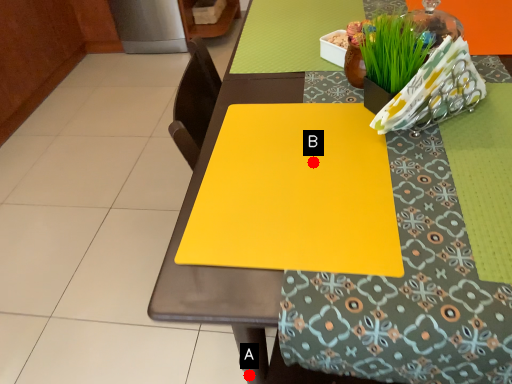
Question: Two points are circled on the image, labeled by A and B beside each circle. Which of the following is the closest to the observer?

Choices:
 (A) A is closer
 (B) B is closer

Answer: (B)